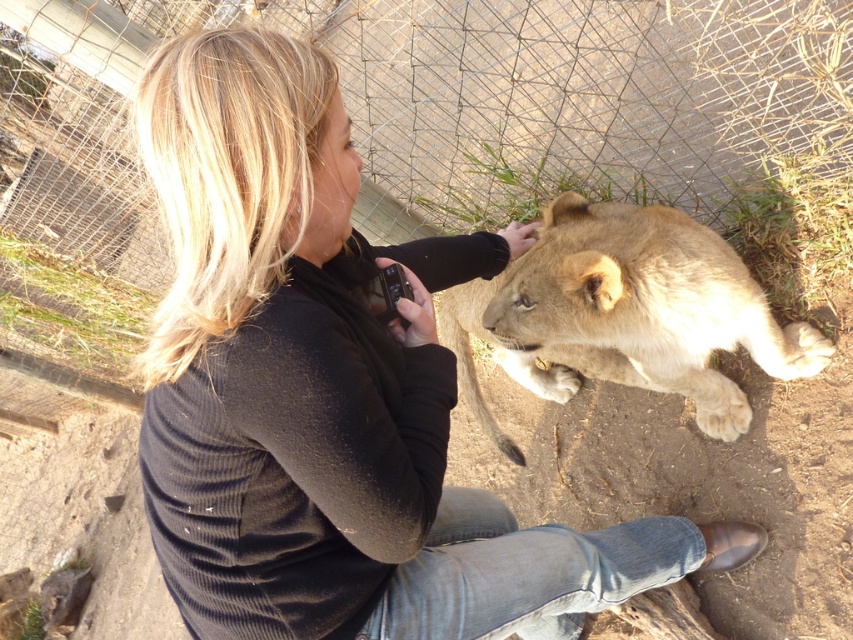
You are a zookeeper planning to move a new animal enclosure. You need to ensure that the metal mesh fence at upper center and the light brown fur at center are visible from the visitor path. Based on their positions, which object will appear closer to the visitors?

The metal mesh fence at upper center is further to the viewer than the light brown fur at center, so the light brown fur at center will appear closer to the visitors.

You are a wildlife photographer positioned at point (796, 346). You want to take a photo of the lion cub but need to move to a better position. If you move to point (213, 13), will you be behind the cub relative to your original position?

Yes, moving to point (213, 13) will place you behind the cub relative to your original position at point (796, 346) because point (213, 13) is behind point (796, 346) according to the spatial description.

You are a zookeeper who needs to ensure the safety of the lion cub. You are standing at the dark gray sweater at center. The metal mesh fence at upper center is part of the enclosure. Can you safely reach the fence from your current position without disturbing the cub?

The distance between the dark gray sweater at center and the metal mesh fence at upper center is 5.49 feet. Since the zookeeper can move towards the fence while maintaining a safe distance from the cub, they can safely reach the fence without disturbing it.